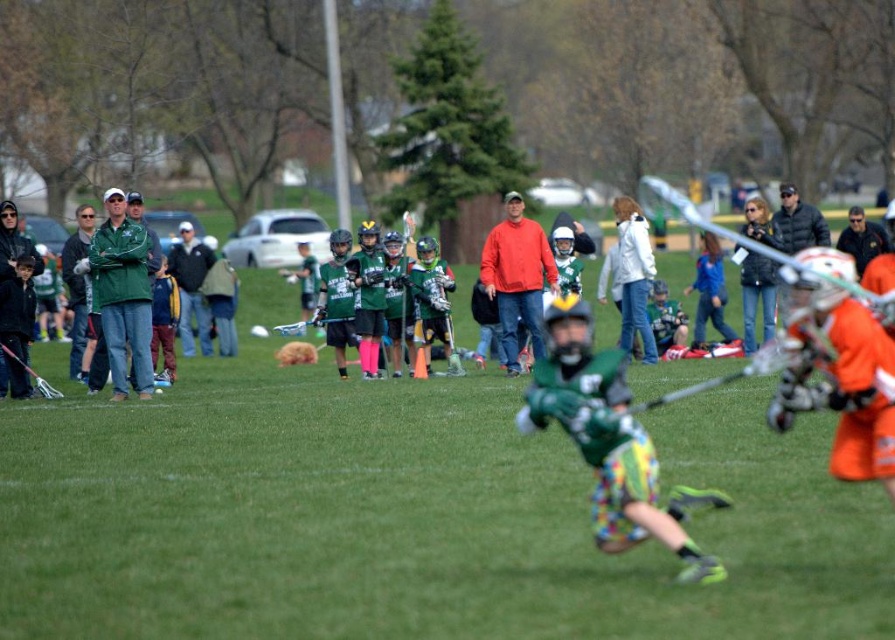
Question: Is green matte jersey at center thinner than orange fleece jacket at center?

Choices:
 (A) yes
 (B) no

Answer: (B)

Question: Which of the following is the farthest from the observer?

Choices:
 (A) (531, 310)
 (B) (637, 516)

Answer: (A)

Question: Does green matte jersey at center have a smaller size compared to orange fleece jacket at center?

Choices:
 (A) yes
 (B) no

Answer: (A)

Question: Is green matte jersey at center to the left of orange fleece jacket at center from the viewer's perspective?

Choices:
 (A) yes
 (B) no

Answer: (A)